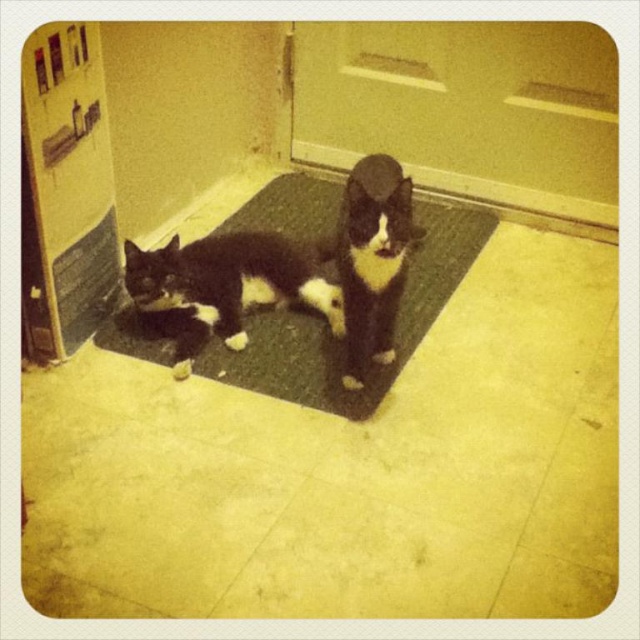
You are a delivery person who needs to step onto the black rubber doormat at center to wipe your shoes. However, there is a black and white fur cat at center lying on it. Can you step onto the doormat without stepping on the cat?

The black rubber doormat at center is wider than the black and white fur cat at center, so yes, you can step onto the doormat without stepping on the cat since there is enough space around the cat.

You are a photographer trying to capture the black fur cat at center and the black and white fur cat at center in a single shot. Which cat is closer to the camera, and will both fit in the frame if you focus on the one that is closer?

The black fur cat at center is closer to the camera since the black and white fur cat at center is behind it. Both cats should fit in the frame as they are positioned at the center, but the black fur cat at center should be the focus to ensure clarity.